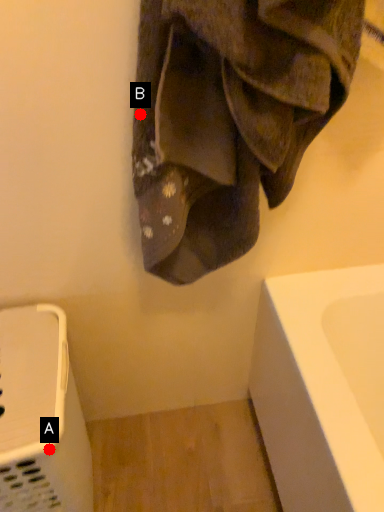
Question: Two points are circled on the image, labeled by A and B beside each circle. Which point is closer to the camera taking this photo?

Choices:
 (A) A is closer
 (B) B is closer

Answer: (B)